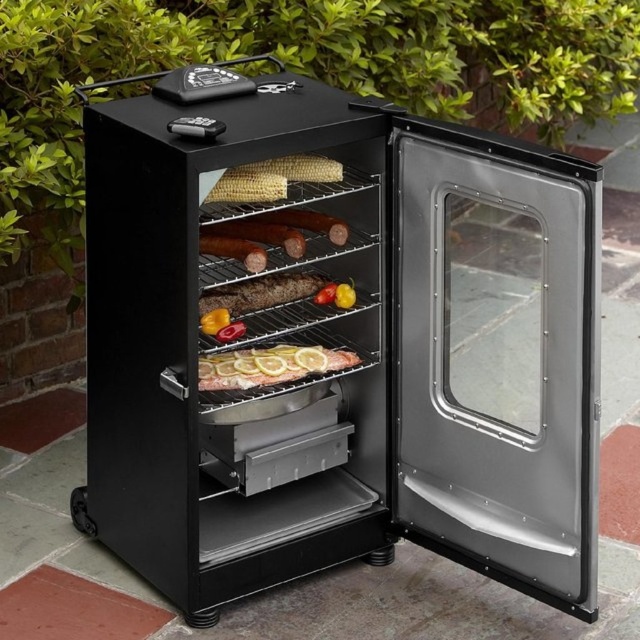
You are standing in front of the smoker and want to retrieve the yellow matte corn at upper center. However, the slightly translucent glass fish at center is blocking your access. Can you remove the corn without moving the fish?

The yellow matte corn at upper center is behind the slightly translucent glass fish at center, so you can reach around or lift the corn carefully without moving the fish.

You are preparing to add a new item to the smoker. The yellow matte corn at upper center and the smokey brown sausage at center are already present. Which of these two items has a greater width?

The yellow matte corn at upper center has a greater width than the smokey brown sausage at center according to the description.